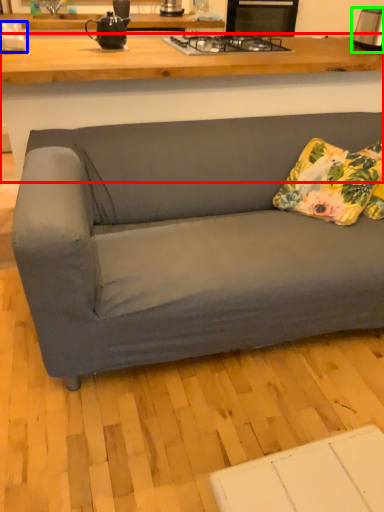
Question: Estimate the real-world distances between objects in this image. Which object is closer to desk (highlighted by a red box), appliance (highlighted by a blue box) or toaster (highlighted by a green box)?

Choices:
 (A) appliance
 (B) toaster

Answer: (A)